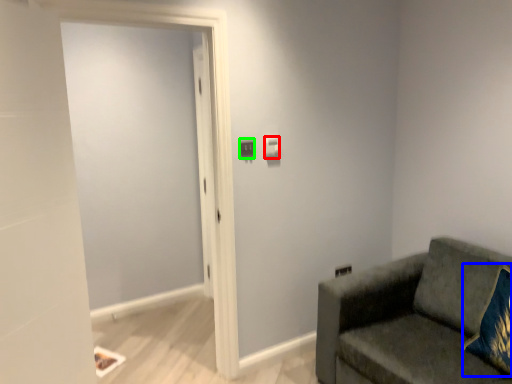
Question: Which object is positioned farthest from light switch (highlighted by a red box)? Select from throw pillow (highlighted by a blue box) and light switch (highlighted by a green box).

Choices:
 (A) throw pillow
 (B) light switch

Answer: (A)